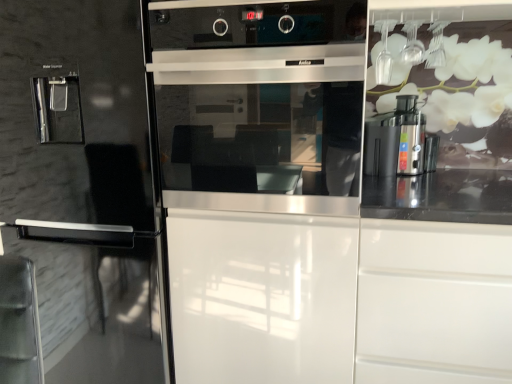
Question: Is satin silver coffee machine at right inside the boundaries of white glossy drawer at right, or outside?

Choices:
 (A) outside
 (B) inside

Answer: (A)

Question: Is point (369, 172) closer or farther from the camera than point (441, 246)?

Choices:
 (A) farther
 (B) closer

Answer: (A)

Question: Estimate the real-world distances between objects in this image. Which object is farther from the glossy black fridge at left?

Choices:
 (A) satin silver oven at center
 (B) satin silver coffee machine at right
 (C) white glossy drawer at right

Answer: (B)

Question: Considering the real-world distances, which object is closest to the satin silver oven at center?

Choices:
 (A) white glossy drawer at right
 (B) glossy black fridge at left
 (C) satin silver coffee machine at right

Answer: (B)